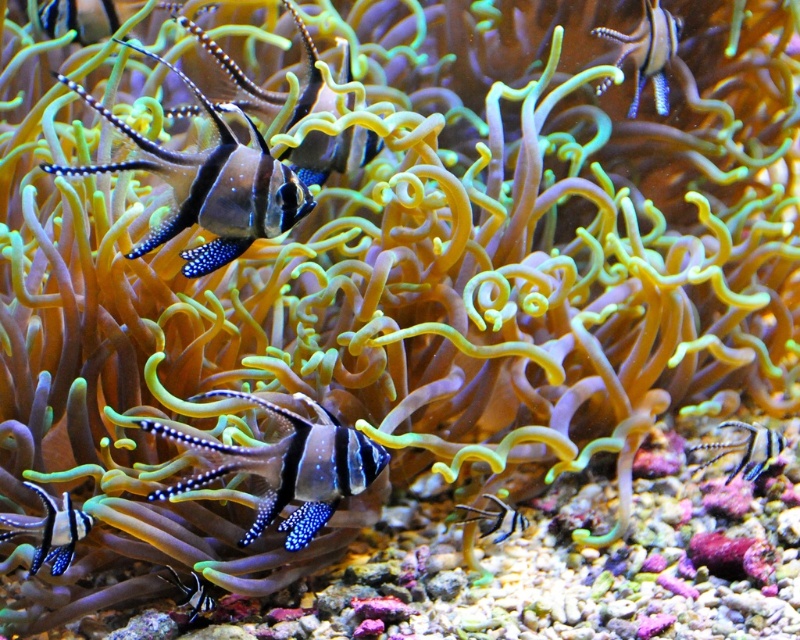
You are a marine biologist observing an underwater scene through a glass aquarium. You see a shiny blue and black fish at upper left. If your reach is 1.1 meters, can you touch the fish without moving your arm?

The shiny blue and black fish at upper left is 1.09 meters away from the viewer. Since your reach is 1.1 meters, you can just barely touch the fish without moving your arm.

You are a marine biologist observing this underwater scene. You need to determine which object is closer to you. The objects are the shiny blue and black fish at upper left and the blue dotted fin at upper right. Which one is nearer?

The shiny blue and black fish at upper left is closer to the viewer than the blue dotted fin at upper right.

You are a marine biologist observing this underwater scene. You need to locate the shiny blue and black fish at upper left and the shiny blue and black striped fish at center. Which fish is positioned higher in the water column?

The shiny blue and black fish at upper left is located above the shiny blue and black striped fish at center, so it is positioned higher in the water column.